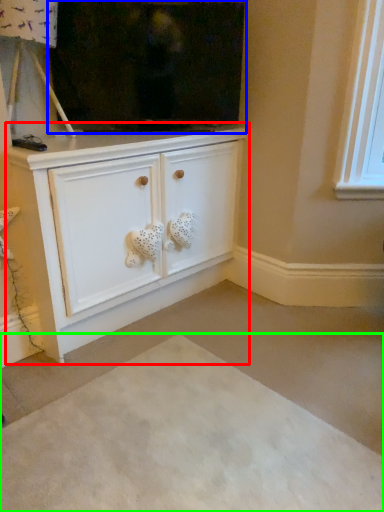
Question: Based on their relative distances, which object is farther from cabinetry (highlighted by a red box)? Choose from fireplace (highlighted by a blue box) and plain (highlighted by a green box).

Choices:
 (A) fireplace
 (B) plain

Answer: (B)